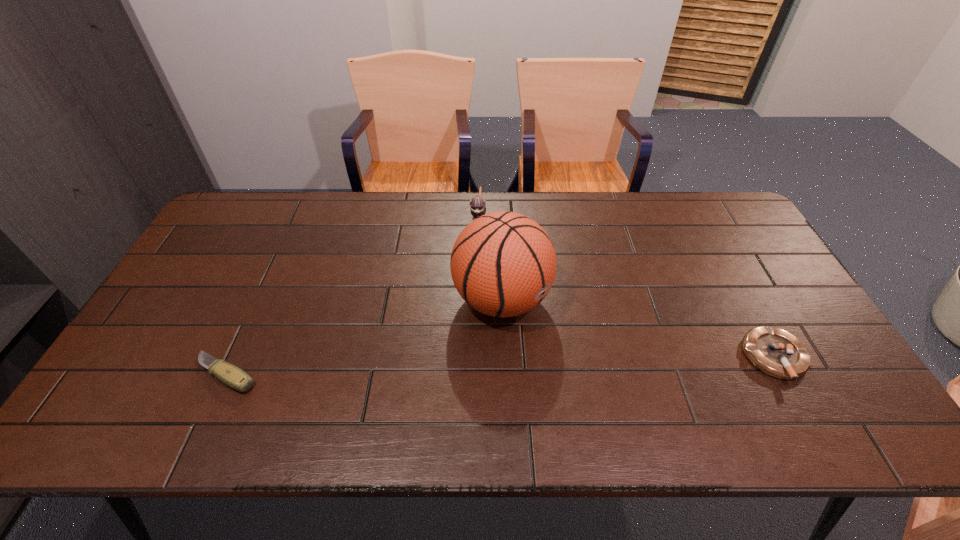
This screenshot has width=960, height=540. Identify the location of vacant spot on the desktop that is between the shortest object and the rightmost object and is positioned on the front-facing side of the farthest object. (459, 367).

In order to click on vacant spot on the desktop that is between the leftmost object and the second shortest object and is positioned on the side where the inflation valve is located in this screenshot , I will do `click(587, 363)`.